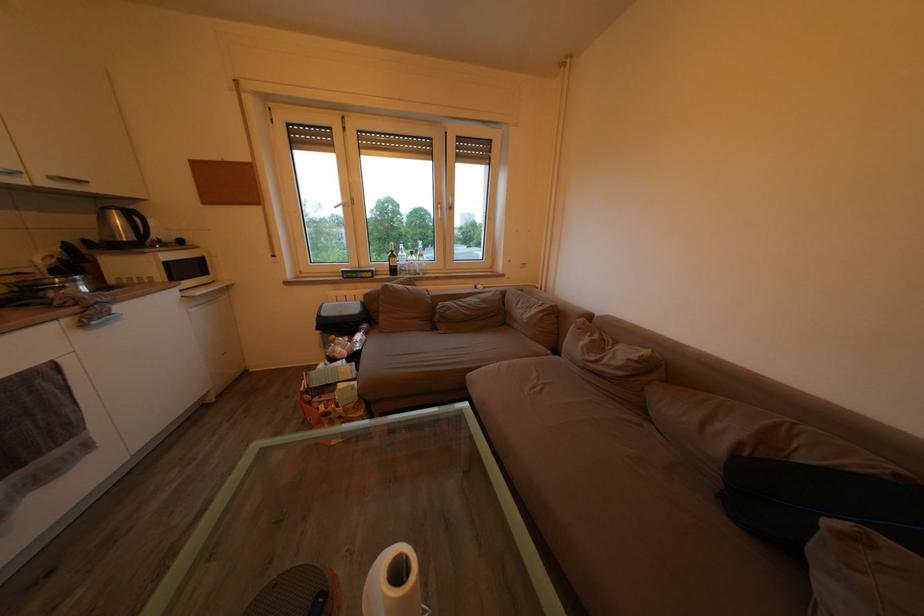
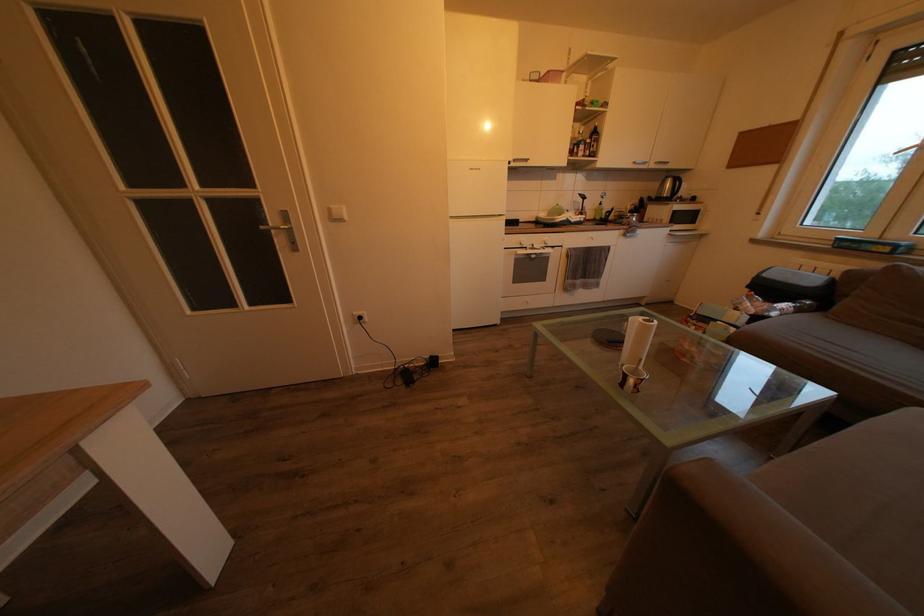
In the scene shown: First-person continuous shooting, in which direction is the camera rotating?

The camera rotated toward left-down.